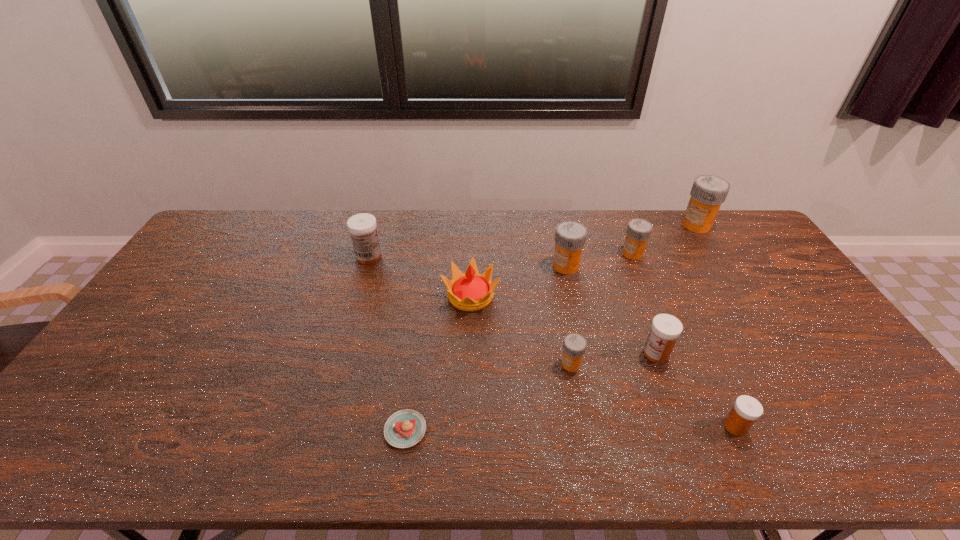
At what (x,y) coordinates should I click in order to perform the action: click on the tallest medicine. Please return your answer as a coordinate pair (x, y). Looking at the image, I should click on (708, 192).

You are a GUI agent. You are given a task and a screenshot of the screen. Output one action in this format:
    pyautogui.click(x=<x>, y=<y>)
    Task: Click on the rightmost orange medicine
    This screenshot has width=960, height=540.
    Given the screenshot: What is the action you would take?
    pyautogui.click(x=708, y=192)

At what (x,y) coordinates should I click in order to perform the action: click on the second biggest orange medicine. Please return your answer as a coordinate pair (x, y). Image resolution: width=960 pixels, height=540 pixels. Looking at the image, I should click on (570, 237).

Locate an element on the screen. the leftmost white medicine is located at coordinates (362, 227).

At what (x,y) coordinates should I click in order to perform the action: click on the leftmost object. Please return your answer as a coordinate pair (x, y). Image resolution: width=960 pixels, height=540 pixels. Looking at the image, I should click on (362, 227).

The width and height of the screenshot is (960, 540). What are the coordinates of `yellow crown` in the screenshot? It's located at (471, 291).

Where is `crown`? crown is located at coordinates (471, 291).

The height and width of the screenshot is (540, 960). In order to click on the third orange medicine from left to right in this screenshot , I will do `click(638, 231)`.

This screenshot has height=540, width=960. What are the coordinates of `the second biggest white medicine` in the screenshot? It's located at (665, 329).

Locate an element on the screen. the second nearest white medicine is located at coordinates tap(665, 329).